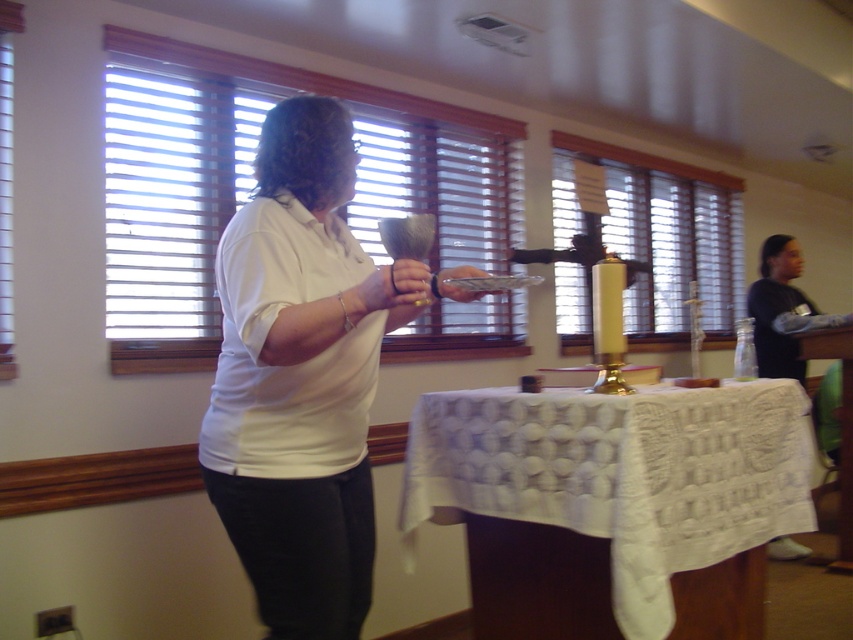
Does white matte shirt at center appear over white lace tablecloth at center?

Correct, white matte shirt at center is located above white lace tablecloth at center.

Does point (248, 230) lie behind point (666, 566)?

No, (248, 230) is in front of (666, 566).

Identify the location of white matte shirt at center. (303, 376).